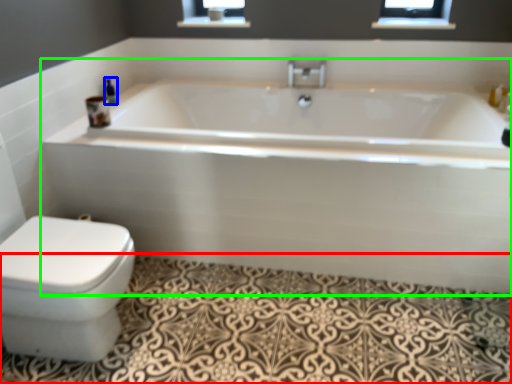
Question: Estimate the real-world distances between objects in this image. Which object is farther from bath mat (highlighted by a red box), toiletry (highlighted by a blue box) or bathtub (highlighted by a green box)?

Choices:
 (A) toiletry
 (B) bathtub

Answer: (A)